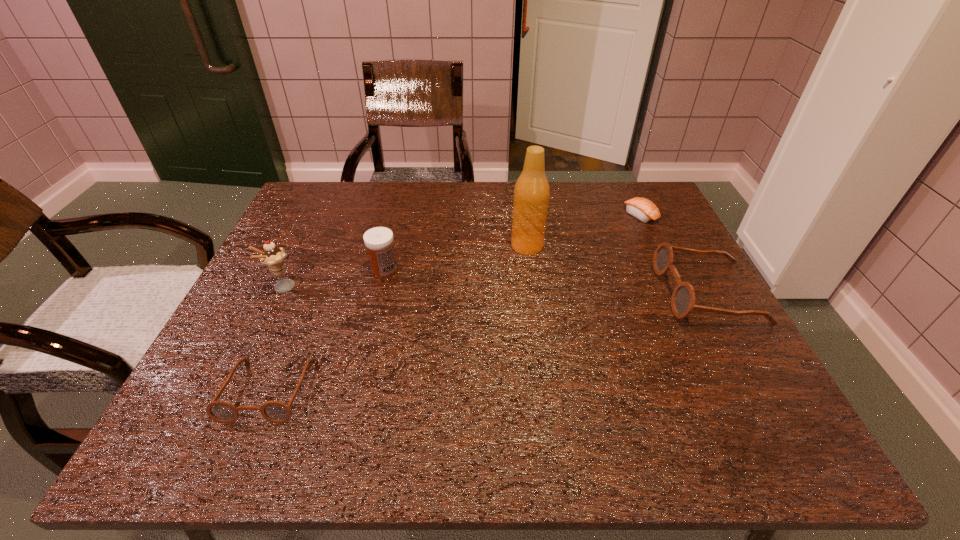
Locate an element on the screen. The width and height of the screenshot is (960, 540). the fourth shortest object is located at coordinates (379, 241).

Identify the location of vacant region located 0.260m on the front-facing side of the farther spectacles. The width and height of the screenshot is (960, 540). (555, 292).

Locate an element on the screen. The height and width of the screenshot is (540, 960). vacant space located on the front-facing side of the farther spectacles is located at coordinates (616, 292).

I want to click on free point located 0.290m on the front-facing side of the farther spectacles, so click(x=542, y=292).

Locate an element on the screen. vacant region located on the front of the shortest object is located at coordinates (660, 256).

The height and width of the screenshot is (540, 960). What are the coordinates of `free space located 0.200m on the right of the second tallest object` in the screenshot? It's located at (379, 288).

Where is `vacant space located on the front of the third object from right to left`? The width and height of the screenshot is (960, 540). vacant space located on the front of the third object from right to left is located at coordinates (545, 384).

Where is `free space located on the back of the third object from left to right`? free space located on the back of the third object from left to right is located at coordinates (391, 246).

The image size is (960, 540). What are the coordinates of `object located at the far edge` in the screenshot? It's located at (643, 209).

Where is `object situated at the near edge`? The width and height of the screenshot is (960, 540). object situated at the near edge is located at coordinates (277, 412).